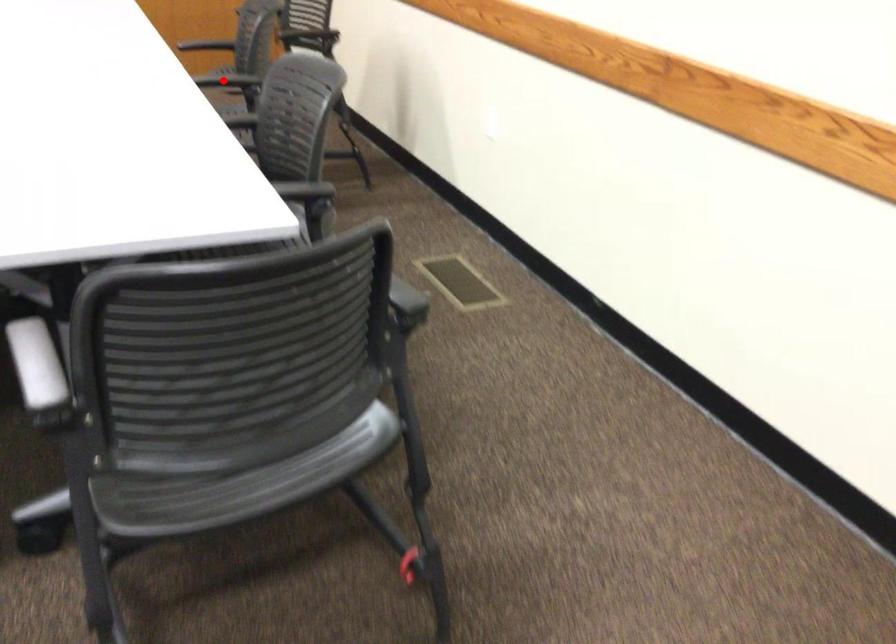
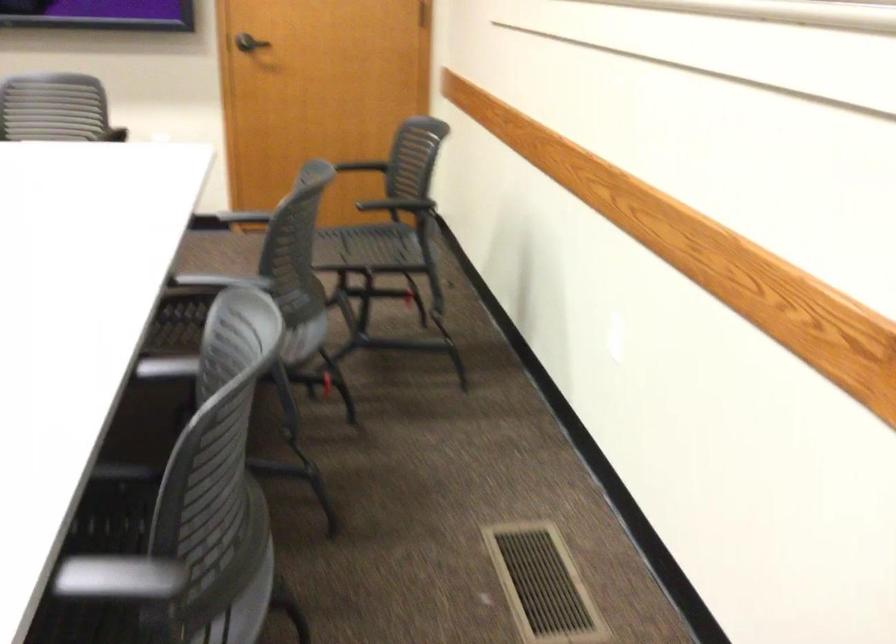
Locate, in the second image, the point that corresponds to the highlighted location in the first image.

(220, 281)